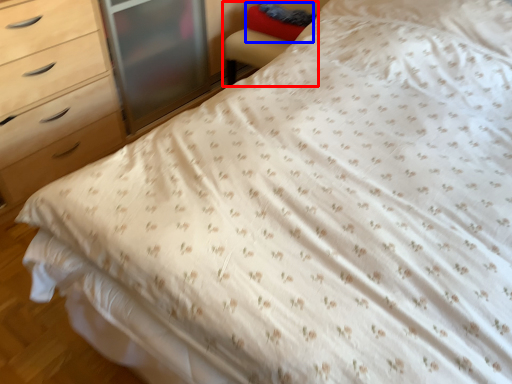
Question: Which object appears farthest to the camera in this image, armchair (highlighted by a red box) or pillow (highlighted by a blue box)?

Choices:
 (A) armchair
 (B) pillow

Answer: (B)